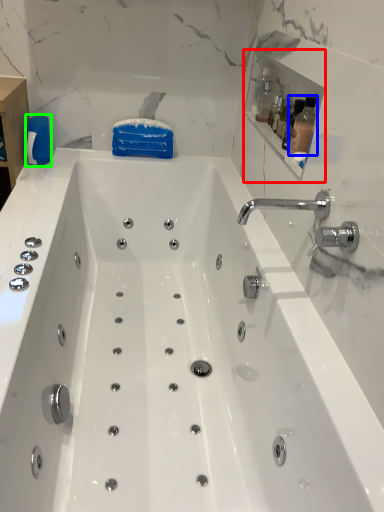
Question: Based on their relative distances, which object is nearer to medicine cabinet (highlighted by a red box)? Choose from bottle (highlighted by a blue box) and cleaning product (highlighted by a green box).

Choices:
 (A) bottle
 (B) cleaning product

Answer: (A)